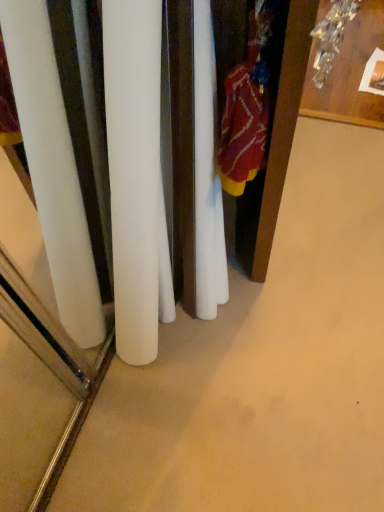
Describe the element at coordinates (246, 108) in the screenshot. Image resolution: width=384 pixels, height=512 pixels. I see `knitted wool sweater at right` at that location.

What do you see at coordinates (272, 143) in the screenshot? I see `wooden armoire at right` at bounding box center [272, 143].

Image resolution: width=384 pixels, height=512 pixels. What do you see at coordinates (349, 74) in the screenshot? I see `wooden table at upper right` at bounding box center [349, 74].

In order to click on knitted wool sweater at right in this screenshot , I will do `click(246, 108)`.

Considering the relative positions of wooden armoire at right and wooden table at upper right in the image provided, is wooden armoire at right in front of wooden table at upper right?

Yes.

Locate an element on the screen. This screenshot has height=512, width=384. armoire that is above the wooden table at upper right (from a real-world perspective) is located at coordinates (272, 143).

Which of these two, wooden armoire at right or wooden table at upper right, is wider?

With larger width is wooden table at upper right.

How different are the orientations of knitted wool sweater at right and wooden armoire at right in degrees?

The angular difference between knitted wool sweater at right and wooden armoire at right is 174 degrees.

Does knitted wool sweater at right have a lesser height compared to wooden armoire at right?

Indeed, knitted wool sweater at right has a lesser height compared to wooden armoire at right.

Which object is closer to the camera taking this photo, knitted wool sweater at right or wooden armoire at right?

knitted wool sweater at right.

Would you say knitted wool sweater at right is a long distance from wooden table at upper right?

knitted wool sweater at right is far away from wooden table at upper right.

Can you confirm if knitted wool sweater at right is positioned to the right of wooden table at upper right?

No, knitted wool sweater at right is not to the right of wooden table at upper right.

How different are the orientations of knitted wool sweater at right and wooden table at upper right in degrees?

There is a 78.9-degree angle between the facing directions of knitted wool sweater at right and wooden table at upper right.

Could you tell me if knitted wool sweater at right is facing wooden table at upper right?

No, knitted wool sweater at right is not oriented towards wooden table at upper right.

From a real-world perspective, does wooden table at upper right stand above wooden armoire at right?

No, from a real-world perspective, wooden table at upper right is not above wooden armoire at right.

Considering the sizes of objects wooden table at upper right and wooden armoire at right in the image provided, who is bigger, wooden table at upper right or wooden armoire at right?

wooden armoire at right is bigger.

Considering the sizes of objects wooden table at upper right and wooden armoire at right in the image provided, who is shorter, wooden table at upper right or wooden armoire at right?

wooden table at upper right.

How different are the orientations of wooden table at upper right and wooden armoire at right in degrees?

The angular difference between wooden table at upper right and wooden armoire at right is 95.6 degrees.

Considering the points (340, 66) and (245, 67), which point is behind, point (340, 66) or point (245, 67)?

Positioned behind is point (340, 66).

Considering the relative positions of wooden table at upper right and knitted wool sweater at right in the image provided, is wooden table at upper right to the left of knitted wool sweater at right from the viewer's perspective?

In fact, wooden table at upper right is to the right of knitted wool sweater at right.

Is wooden table at upper right bigger than knitted wool sweater at right?

Yes, wooden table at upper right is bigger than knitted wool sweater at right.

Considering the positions of objects wooden armoire at right and knitted wool sweater at right in the image provided, who is more to the left, wooden armoire at right or knitted wool sweater at right?

knitted wool sweater at right.

From the image's perspective, is wooden armoire at right above knitted wool sweater at right?

Yes.

Are wooden armoire at right and knitted wool sweater at right far apart?

wooden armoire at right is actually quite close to knitted wool sweater at right.

From a real-world perspective, which is physically below, wooden armoire at right or knitted wool sweater at right?

wooden armoire at right.

You are a GUI agent. You are given a task and a screenshot of the screen. Output one action in this format:
    pyautogui.click(x=<x>, y=<y>)
    Task: Click on the furniture lying behind the wooden armoire at right
    
    Given the screenshot: What is the action you would take?
    pyautogui.click(x=349, y=74)

You are a GUI agent. You are given a task and a screenshot of the screen. Output one action in this format:
    pyautogui.click(x=<x>, y=<y>)
    Task: Click on the clothing below the wooden armoire at right (from the image's perspective)
    The image size is (384, 512).
    Given the screenshot: What is the action you would take?
    pyautogui.click(x=246, y=108)

Based on the photo, considering their positions, is wooden armoire at right positioned further to wooden table at upper right than knitted wool sweater at right?

knitted wool sweater at right.

Considering their positions, is knitted wool sweater at right positioned further to wooden armoire at right than wooden table at upper right?

Based on the image, wooden table at upper right appears to be further to wooden armoire at right.

Based on their spatial positions, is knitted wool sweater at right or wooden armoire at right further from wooden table at upper right?

Based on the image, knitted wool sweater at right appears to be further to wooden table at upper right.

Looking at the image, which one is located further to knitted wool sweater at right, wooden table at upper right or wooden armoire at right?

wooden table at upper right is further to knitted wool sweater at right.

Estimate the real-world distances between objects in this image. Which object is closer to knitted wool sweater at right, wooden armoire at right or wooden table at upper right?

Based on the image, wooden armoire at right appears to be nearer to knitted wool sweater at right.

Based on their spatial positions, is wooden table at upper right or knitted wool sweater at right further from wooden armoire at right?

wooden table at upper right lies further to wooden armoire at right than the other object.

Identify the location of armoire between knitted wool sweater at right and wooden table at upper right along the z-axis. The image size is (384, 512). (272, 143).